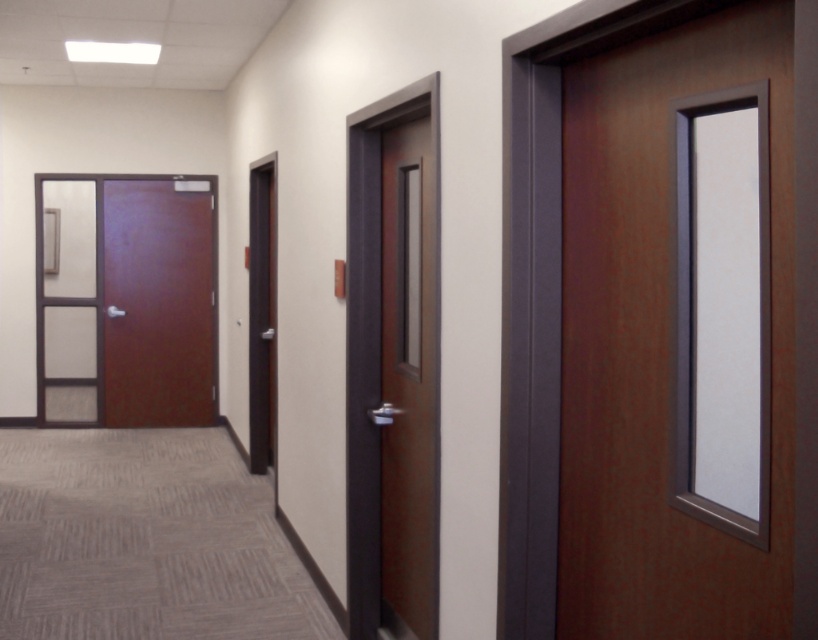
You are standing in the hallway and need to determine the distance between two points. The first point is at coordinates point (180, 237) and the second point is at coordinates point (411, 600). Which point is closer to you?

Point (180, 237) is closer to you because it is further to the viewer than point (411, 600).

You are standing in the hallway and need to enter the room behind the brown wood door at left or the brown wood door at center. Which door is higher up in the hallway?

The brown wood door at left is located above the brown wood door at center, so it is higher up in the hallway.